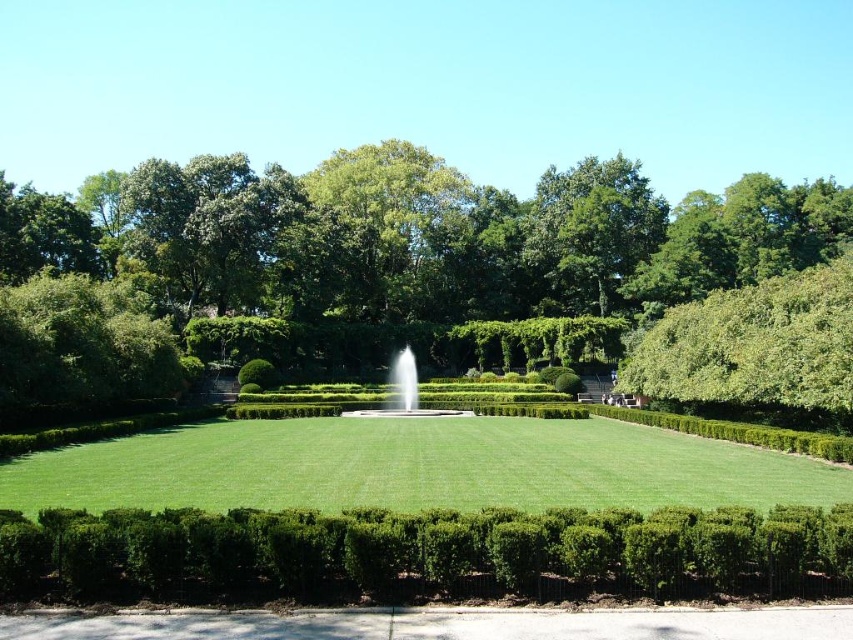
Does green leafy tree at center come behind white marble fountain at center?

No, it is in front of white marble fountain at center.

Looking at this image, can you confirm if green leafy tree at center is wider than white marble fountain at center?

Yes.

Describe the element at coordinates (412, 243) in the screenshot. I see `green leafy tree at center` at that location.

The width and height of the screenshot is (853, 640). Find the location of `green leafy tree at center`. green leafy tree at center is located at coordinates (412, 243).

Can you confirm if green leafy hedge at center is taller than green lawn at center?

Indeed, green leafy hedge at center has a greater height compared to green lawn at center.

Who is positioned more to the left, green leafy hedge at center or green lawn at center?

Positioned to the left is green lawn at center.

Which is behind, point (355, 556) or point (587, 440)?

The point (587, 440) is more distant.

This screenshot has width=853, height=640. In order to click on green leafy hedge at center in this screenshot , I will do `click(424, 554)`.

Which is below, green leafy tree at center or green leafy hedge at center?

Positioned lower is green leafy hedge at center.

Can you confirm if green leafy tree at center is thinner than green leafy hedge at center?

No, green leafy tree at center is not thinner than green leafy hedge at center.

Is point (184, 316) more distant than point (167, 580)?

That is True.

This screenshot has width=853, height=640. Find the location of `green leafy tree at center`. green leafy tree at center is located at coordinates (412, 243).